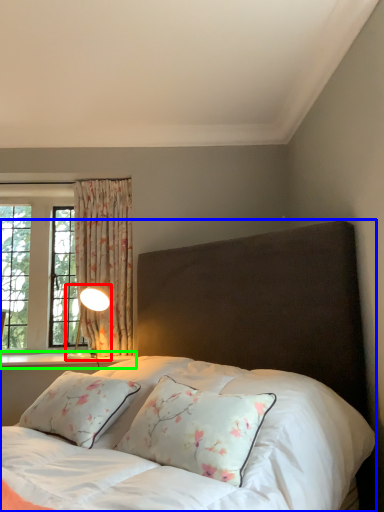
Question: Which is farther away from table lamp (highlighted by a red box)? bed (highlighted by a blue box) or window sill (highlighted by a green box)?

Choices:
 (A) bed
 (B) window sill

Answer: (A)